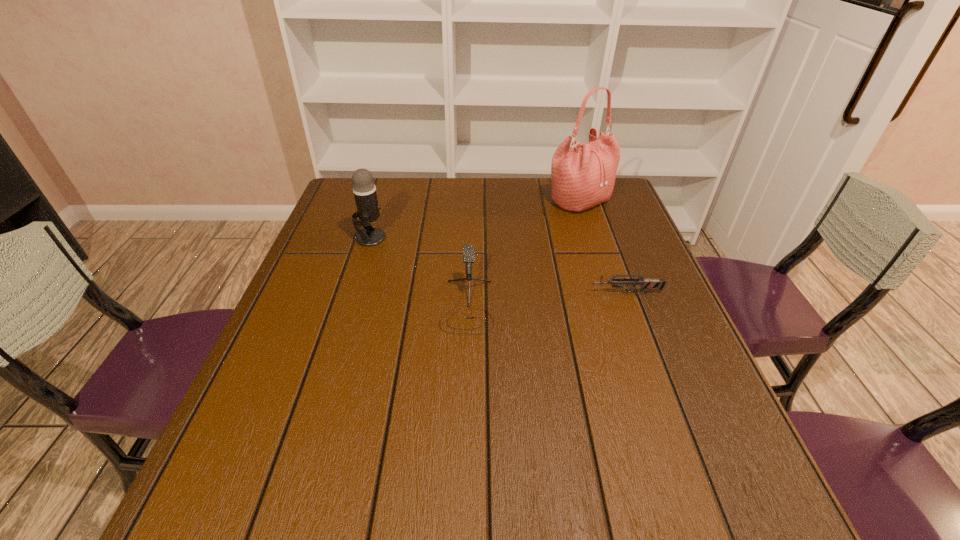
The image size is (960, 540). Identify the location of vacant space at the left edge. (325, 317).

The image size is (960, 540). In the image, there is a desktop. Find the location of `free region at the right edge`. free region at the right edge is located at coordinates (641, 370).

Identify the location of free space at the far left corner of the desktop. (347, 180).

Image resolution: width=960 pixels, height=540 pixels. In order to click on vacant space at the far right corner of the desktop in this screenshot , I will do [x=610, y=204].

Identify the location of vacant area between the third shortest object and the handbag. Image resolution: width=960 pixels, height=540 pixels. (475, 219).

This screenshot has width=960, height=540. I want to click on unoccupied position between the handbag and the taller microphone, so click(x=475, y=219).

Where is `vacant space in between the leftmost object and the farthest object`? This screenshot has width=960, height=540. vacant space in between the leftmost object and the farthest object is located at coordinates (475, 219).

At what (x,y) coordinates should I click in order to perform the action: click on free space that is in between the leftmost object and the farthest object. Please return your answer as a coordinate pair (x, y). The width and height of the screenshot is (960, 540). Looking at the image, I should click on (475, 219).

What are the coordinates of `unoccupied position between the nearer microphone and the tallest object` in the screenshot? It's located at (523, 253).

At what (x,y) coordinates should I click in order to perform the action: click on vacant space that's between the gun and the handbag. Please return your answer as a coordinate pair (x, y). Image resolution: width=960 pixels, height=540 pixels. Looking at the image, I should click on (602, 246).